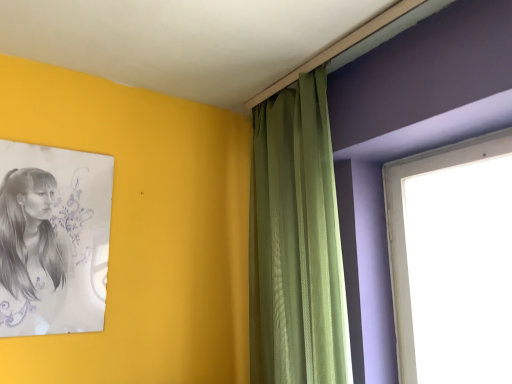
Question: In terms of width, does green textured curtain at upper center look wider or thinner when compared to black paper portrait at left?

Choices:
 (A) wide
 (B) thin

Answer: (A)

Question: Is green textured curtain at upper center situated inside black paper portrait at left or outside?

Choices:
 (A) inside
 (B) outside

Answer: (B)

Question: From the image's perspective, relative to black paper portrait at left, is green textured curtain at upper center above or below?

Choices:
 (A) below
 (B) above

Answer: (B)

Question: From a real-world perspective, relative to green textured curtain at upper center, is black paper portrait at left vertically above or below?

Choices:
 (A) above
 (B) below

Answer: (B)

Question: Do you think black paper portrait at left is within green textured curtain at upper center, or outside of it?

Choices:
 (A) outside
 (B) inside

Answer: (A)

Question: Looking at the image, does black paper portrait at left seem bigger or smaller compared to green textured curtain at upper center?

Choices:
 (A) big
 (B) small

Answer: (B)

Question: Considering the positions of black paper portrait at left and green textured curtain at upper center in the image, is black paper portrait at left wider or thinner than green textured curtain at upper center?

Choices:
 (A) wide
 (B) thin

Answer: (B)